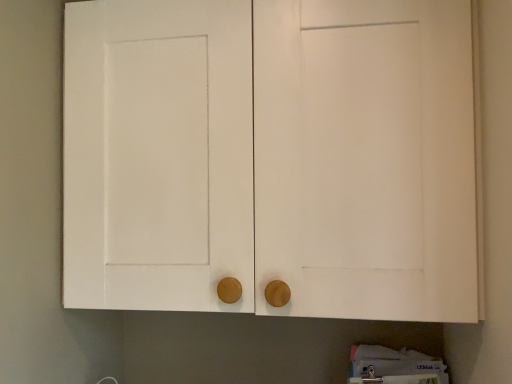
The image size is (512, 384). Describe the element at coordinates (271, 156) in the screenshot. I see `white wood cabinet at center` at that location.

At what (x,y) coordinates should I click in order to perform the action: click on white wood cabinet at center. Please return your answer as a coordinate pair (x, y). Image resolution: width=512 pixels, height=384 pixels. Looking at the image, I should click on (271, 156).

This screenshot has height=384, width=512. Find the location of `white wood cabinet at center`. white wood cabinet at center is located at coordinates (271, 156).